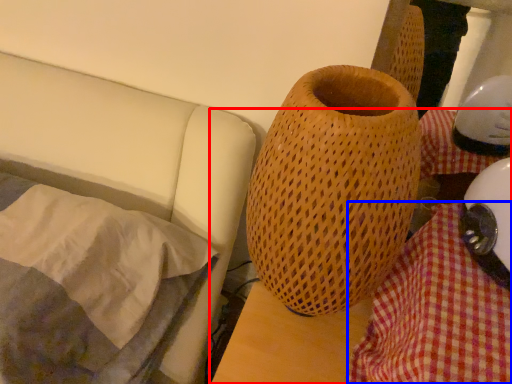
Question: Among these objects, which one is nearest to the camera, table (highlighted by a red box) or blanket (highlighted by a blue box)?

Choices:
 (A) table
 (B) blanket

Answer: (A)